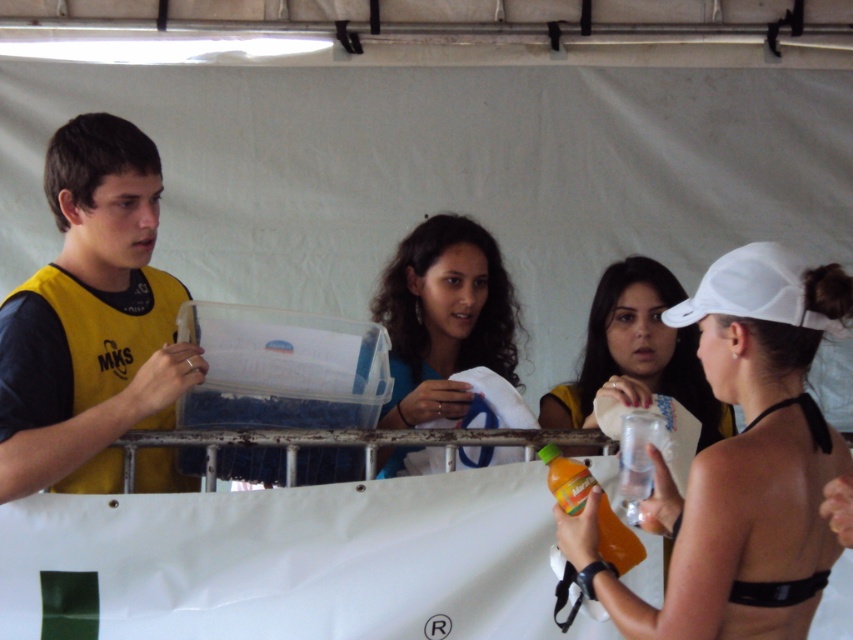
Question: Which object is farther from the camera taking this photo?

Choices:
 (A) yellow fabric shirt at left
 (B) white matte cap at upper right

Answer: (A)

Question: Which of the following is the farthest from the observer?

Choices:
 (A) (135, 230)
 (B) (769, 548)
 (C) (793, 324)
 (D) (396, 355)

Answer: (D)

Question: Does yellow fabric shirt at left appear on the right side of matte white cap at center?

Choices:
 (A) yes
 (B) no

Answer: (B)

Question: Is white matte cap at upper right positioned behind white matte baseball cap at upper right?

Choices:
 (A) no
 (B) yes

Answer: (A)

Question: Estimate the real-world distances between objects in this image. Which object is closer to the white matte baseball cap at upper right?

Choices:
 (A) matte white cap at center
 (B) yellow fabric shirt at left
 (C) white matte cap at upper right

Answer: (C)

Question: From the image, what is the correct spatial relationship of yellow fabric shirt at left in relation to matte white cap at center?

Choices:
 (A) below
 (B) above

Answer: (B)